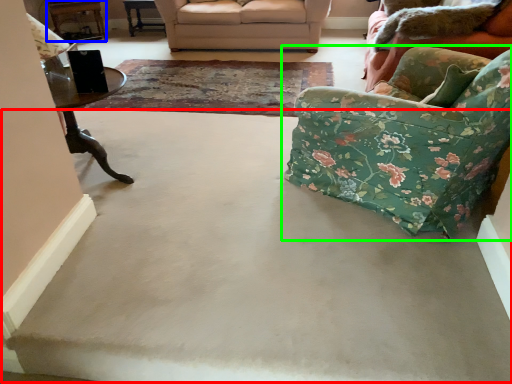
Question: Which object is positioned farthest from concrete (highlighted by a red box)? Select from table (highlighted by a blue box) and chair (highlighted by a green box).

Choices:
 (A) table
 (B) chair

Answer: (A)